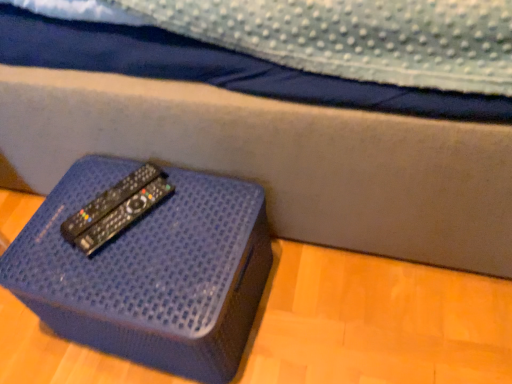
Question: Can you confirm if black plastic remote at center is positioned to the left of blue textured box at lower left?

Choices:
 (A) yes
 (B) no

Answer: (A)

Question: From a real-world perspective, does black plastic remote at center stand above blue textured box at lower left?

Choices:
 (A) no
 (B) yes

Answer: (B)

Question: Is black plastic remote at center wider than blue textured box at lower left?

Choices:
 (A) no
 (B) yes

Answer: (A)

Question: Considering the relative positions of black plastic remote at center and blue textured box at lower left in the image provided, is black plastic remote at center to the right of blue textured box at lower left from the viewer's perspective?

Choices:
 (A) yes
 (B) no

Answer: (B)

Question: Is black plastic remote at center in contact with blue textured box at lower left?

Choices:
 (A) yes
 (B) no

Answer: (B)

Question: From the image's perspective, is black plastic remote at center beneath blue textured box at lower left?

Choices:
 (A) no
 (B) yes

Answer: (A)

Question: Is blue textured box at lower left smaller than black plastic remote at center?

Choices:
 (A) yes
 (B) no

Answer: (B)

Question: Is blue textured box at lower left far from black plastic remote at center?

Choices:
 (A) yes
 (B) no

Answer: (B)

Question: From the image's perspective, is blue textured box at lower left on black plastic remote at center?

Choices:
 (A) no
 (B) yes

Answer: (A)

Question: Is blue textured box at lower left taller than black plastic remote at center?

Choices:
 (A) no
 (B) yes

Answer: (B)

Question: From a real-world perspective, is blue textured box at lower left under black plastic remote at center?

Choices:
 (A) yes
 (B) no

Answer: (A)

Question: Does blue textured box at lower left come in front of black plastic remote at center?

Choices:
 (A) no
 (B) yes

Answer: (B)

Question: Is blue textured box at lower left bigger or smaller than black plastic remote at center?

Choices:
 (A) big
 (B) small

Answer: (A)